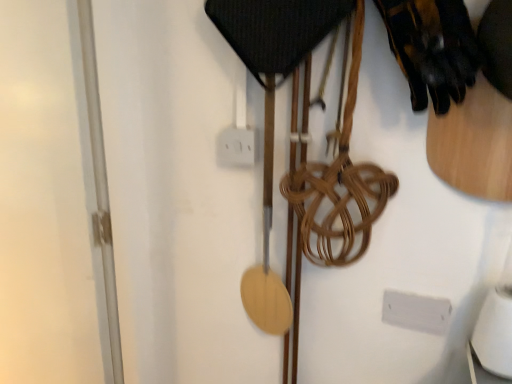
What is the approximate height of transparent glass door at left?

It is 1.34 meters.

At what (x,y) coordinates should I click in order to perform the action: click on transparent glass door at left. Please return your answer as a coordinate pair (x, y). The width and height of the screenshot is (512, 384). Looking at the image, I should click on tap(53, 200).

Is transparent glass door at left completely or partially outside of black leather gloves at upper right?

Yes, transparent glass door at left is located beyond the bounds of black leather gloves at upper right.

Where is `footwear above the transparent glass door at left (from the image's perspective)`? Image resolution: width=512 pixels, height=384 pixels. footwear above the transparent glass door at left (from the image's perspective) is located at coordinates (432, 49).

Which is in front, point (91, 119) or point (450, 48)?

Positioned in front is point (450, 48).

Which object is further away from the camera, transparent glass door at left or black leather gloves at upper right?

transparent glass door at left is further away from the camera.

From a real-world perspective, which object rests below the other?

white plastic electric outlet at center.

Which object is closer to the camera taking this photo, black leather gloves at upper right or white plastic electric outlet at center?

black leather gloves at upper right is in front.

Is black leather gloves at upper right far from white plastic electric outlet at center?

No, black leather gloves at upper right is in close proximity to white plastic electric outlet at center.

Image resolution: width=512 pixels, height=384 pixels. Find the location of `footwear positioned vertically above the white plastic electric outlet at center (from a real-world perspective)`. footwear positioned vertically above the white plastic electric outlet at center (from a real-world perspective) is located at coordinates (432, 49).

From the image's perspective, between white plastic electric outlet at center and transparent glass door at left, who is located below?

transparent glass door at left appears lower in the image.

From a real-world perspective, which object rests below the other?

transparent glass door at left, from a real-world perspective.

Is the position of white plastic electric outlet at center more distant than that of transparent glass door at left?

Yes, it is.

From the picture: From the image's perspective, is black leather gloves at upper right positioned above or below transparent glass door at left?

From the image's perspective, black leather gloves at upper right appears above transparent glass door at left.

Looking at this image, how many degrees apart are the facing directions of black leather gloves at upper right and transparent glass door at left?

9.22 degrees.

From a real-world perspective, is black leather gloves at upper right below transparent glass door at left?

No.

Considering the relative sizes of black leather gloves at upper right and transparent glass door at left in the image provided, is black leather gloves at upper right taller than transparent glass door at left?

Incorrect, the height of black leather gloves at upper right is not larger of that of transparent glass door at left.

In terms of size, does transparent glass door at left appear bigger or smaller than white plastic electric outlet at center?

Considering their sizes, transparent glass door at left takes up more space than white plastic electric outlet at center.

You are a GUI agent. You are given a task and a screenshot of the screen. Output one action in this format:
    pyautogui.click(x=<x>, y=<y>)
    Task: Click on the glass door that appears on the left of white plastic electric outlet at center
    The width and height of the screenshot is (512, 384).
    Given the screenshot: What is the action you would take?
    pyautogui.click(x=53, y=200)

From a real-world perspective, is transparent glass door at left located higher than white plastic electric outlet at center?

Incorrect, from a real-world perspective, transparent glass door at left is lower than white plastic electric outlet at center.

Measure the distance between transparent glass door at left and white plastic electric outlet at center.

transparent glass door at left and white plastic electric outlet at center are 58.87 centimeters apart.

In the scene shown: Is white plastic electric outlet at center further to camera compared to black leather gloves at upper right?

Yes, it is.

From a real-world perspective, does white plastic electric outlet at center stand above black leather gloves at upper right?

No, from a real-world perspective, white plastic electric outlet at center is not above black leather gloves at upper right.

Considering the sizes of white plastic electric outlet at center and black leather gloves at upper right in the image, is white plastic electric outlet at center bigger or smaller than black leather gloves at upper right?

In the image, white plastic electric outlet at center appears to be smaller than black leather gloves at upper right.

At what (x,y) coordinates should I click in order to perform the action: click on glass door beneath the black leather gloves at upper right (from a real-world perspective). Please return your answer as a coordinate pair (x, y). The height and width of the screenshot is (384, 512). Looking at the image, I should click on (53, 200).

Identify the location of electric outlet below the black leather gloves at upper right (from the image's perspective). The image size is (512, 384). (236, 147).

From the image, which object appears to be nearer to white plastic electric outlet at center, black leather gloves at upper right or transparent glass door at left?

black leather gloves at upper right is closer to white plastic electric outlet at center.

Which object lies nearer to the anchor point transparent glass door at left, white plastic electric outlet at center or black leather gloves at upper right?

white plastic electric outlet at center.

Based on their spatial positions, is white plastic electric outlet at center or transparent glass door at left further from black leather gloves at upper right?

The object further to black leather gloves at upper right is transparent glass door at left.

Looking at the image, which one is located further to black leather gloves at upper right, transparent glass door at left or white plastic electric outlet at center?

The object further to black leather gloves at upper right is transparent glass door at left.

Looking at the image, which one is located closer to transparent glass door at left, black leather gloves at upper right or white plastic electric outlet at center?

white plastic electric outlet at center is closer to transparent glass door at left.

Looking at the image, which one is located closer to white plastic electric outlet at center, transparent glass door at left or black leather gloves at upper right?

black leather gloves at upper right is closer to white plastic electric outlet at center.

Locate an element on the screen. The height and width of the screenshot is (384, 512). electric outlet between transparent glass door at left and black leather gloves at upper right in the horizontal direction is located at coordinates (236, 147).